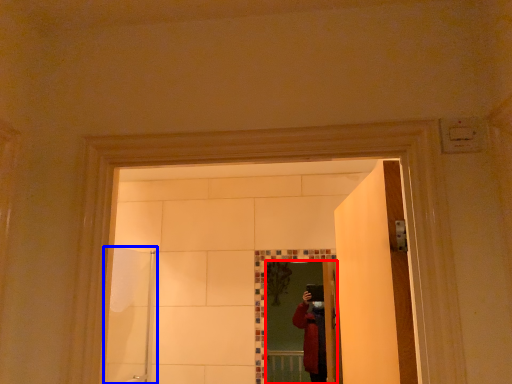
Question: Which point is closer to the camera, mirror (highlighted by a red box) or shower door (highlighted by a blue box)?

Choices:
 (A) mirror
 (B) shower door

Answer: (B)